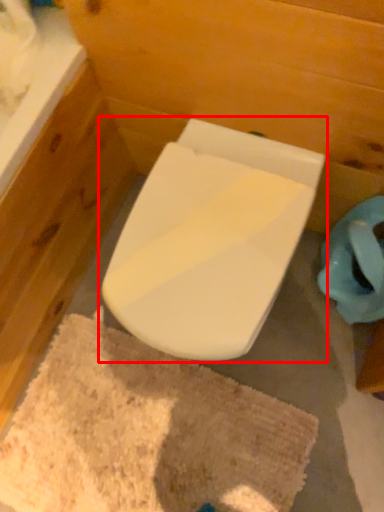
Question: From the image's perspective, what is the correct spatial relationship of toilet (annotated by the red box) in relation to bath mat?

Choices:
 (A) below
 (B) above

Answer: (B)